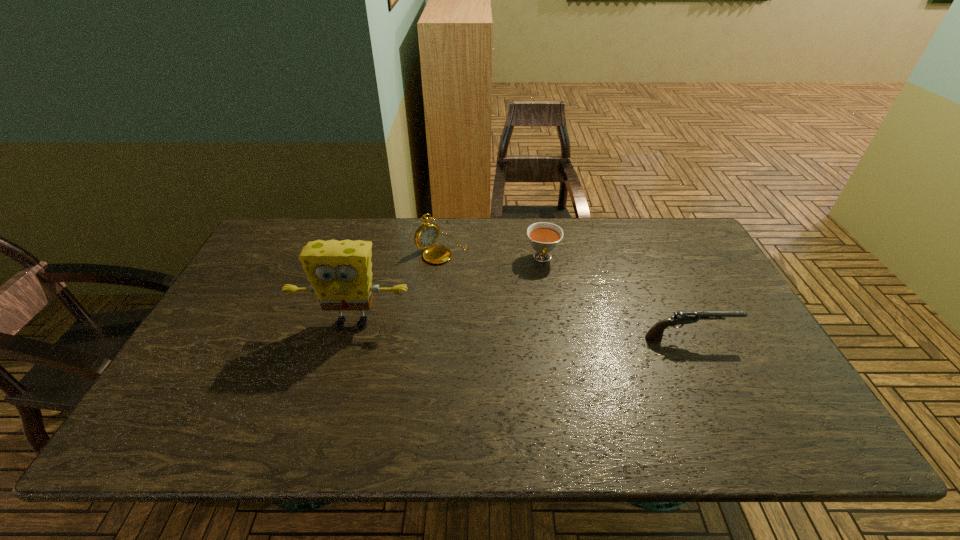
Where is `vacant spot on the desktop that is between the sponge and the gun and is positioned on the face of the third shortest object`? The image size is (960, 540). vacant spot on the desktop that is between the sponge and the gun and is positioned on the face of the third shortest object is located at coordinates (552, 332).

Identify the location of free spot on the desktop that is between the sponge and the gun and is positioned on the side of the second object from right to left with the handle. Image resolution: width=960 pixels, height=540 pixels. (541, 331).